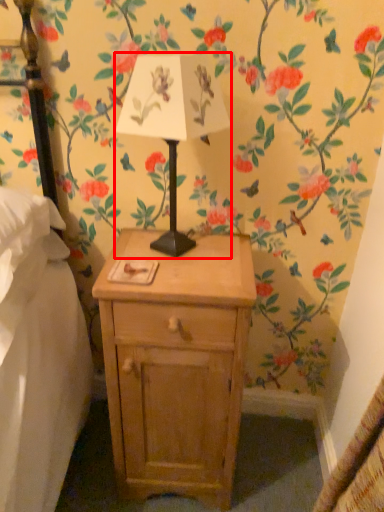
Question: From the image's perspective, where is table lamp (annotated by the red box) located relative to nightstand?

Choices:
 (A) below
 (B) above

Answer: (B)